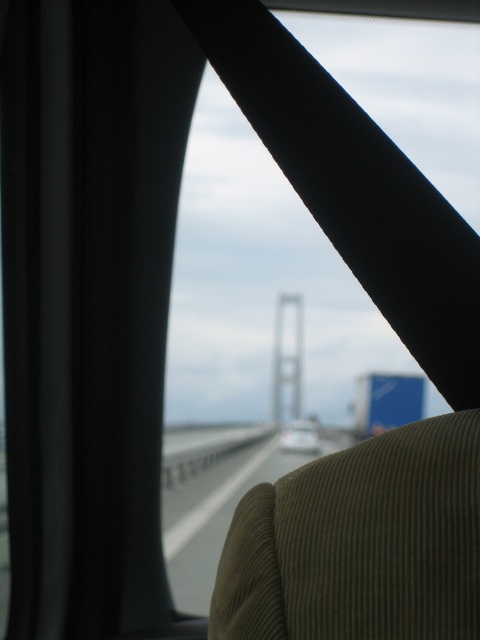
Locate an element on the screen. white asphalt highway at center is located at coordinates (220, 512).

Which is in front, point (208, 504) or point (283, 429)?

Point (208, 504) is more forward.

Which is behind, point (172, 436) or point (308, 436)?

Point (308, 436)

This screenshot has height=640, width=480. Find the location of `white asphalt highway at center`. white asphalt highway at center is located at coordinates (220, 512).